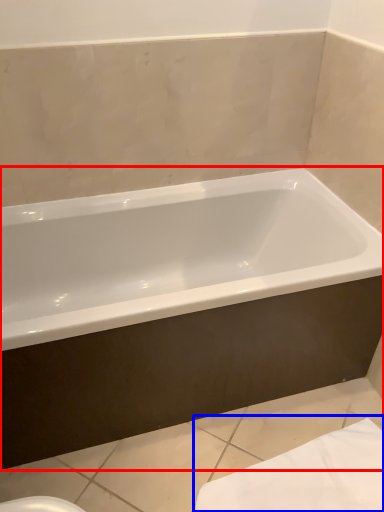
Question: Which object appears closest to the camera in this image, bathtub (highlighted by a red box) or bath towel (highlighted by a blue box)?

Choices:
 (A) bathtub
 (B) bath towel

Answer: (A)